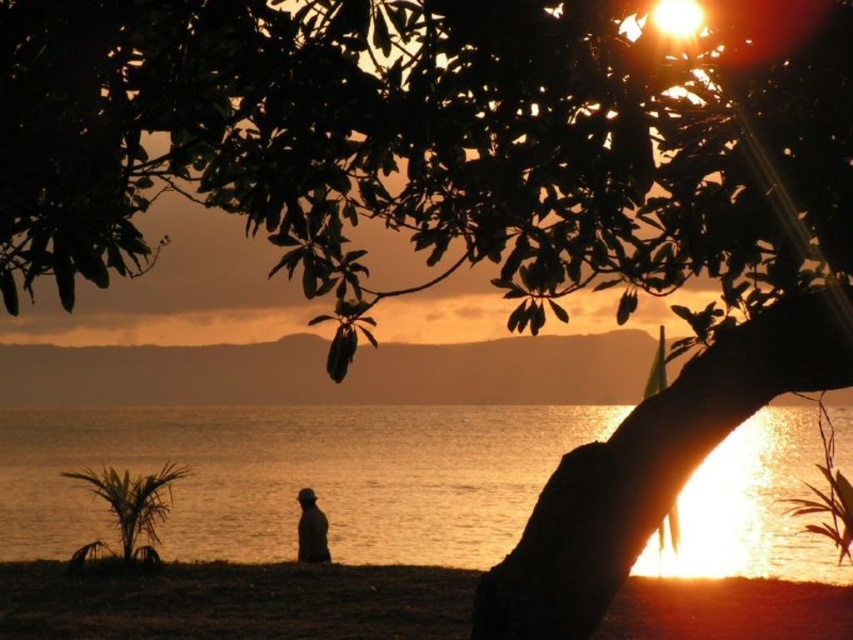
You are standing at the camera position and want to reach the point marked as point (105, 458). Can you estimate how far you need to walk to get there?

The point (105, 458) is 11.57 meters away from the camera, so you need to walk approximately 11.57 meters to reach it.

You are planning to walk from the tree branch silhouette to the distant hills. Which surface would you prefer to walk on, the golden reflective water at center or the brown sand at lower center, and why?

You should walk on the brown sand at lower center because the golden reflective water at center might be wider than brown sand at lower center, making it potentially unsafe to walk on due to its width and possible depth.

You are a photographer trying to capture the sunset scene. You notice the golden reflective water at center and the silhouette figure at lower center. Based on their positions, which object would you focus on first to ensure it appears sharp in your photo?

The golden reflective water at center is above the silhouette figure at lower center, so focusing on the silhouette figure at lower center first would ensure it appears sharp since it is closer to the camera.